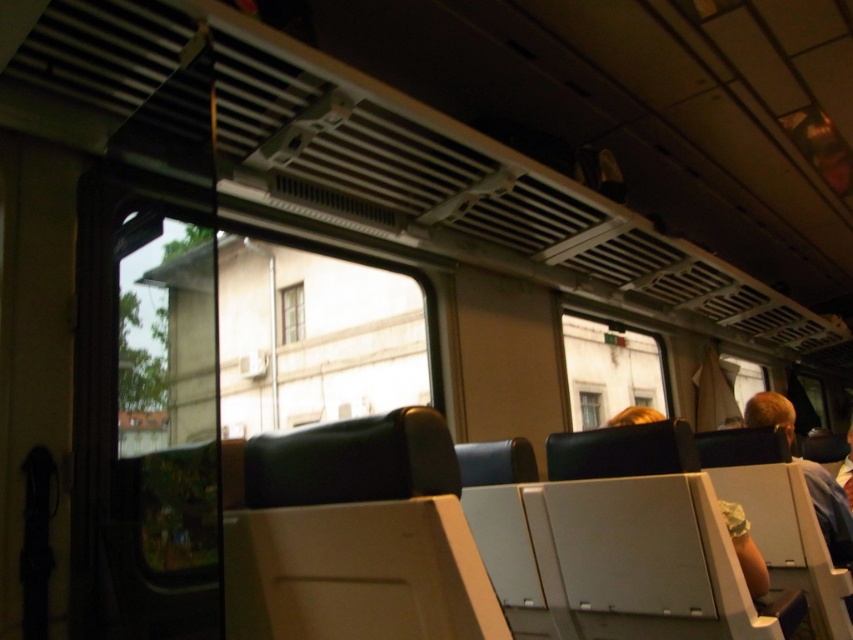
You are a passenger sitting in the train carriage and want to know if you can place your phone on the light brown leather armrest at center without blocking the view through the white wooden window at center. Is this possible?

The light brown leather armrest at center is not as tall as the white wooden window at center, so placing your phone there would not block the view through the white wooden window at center.